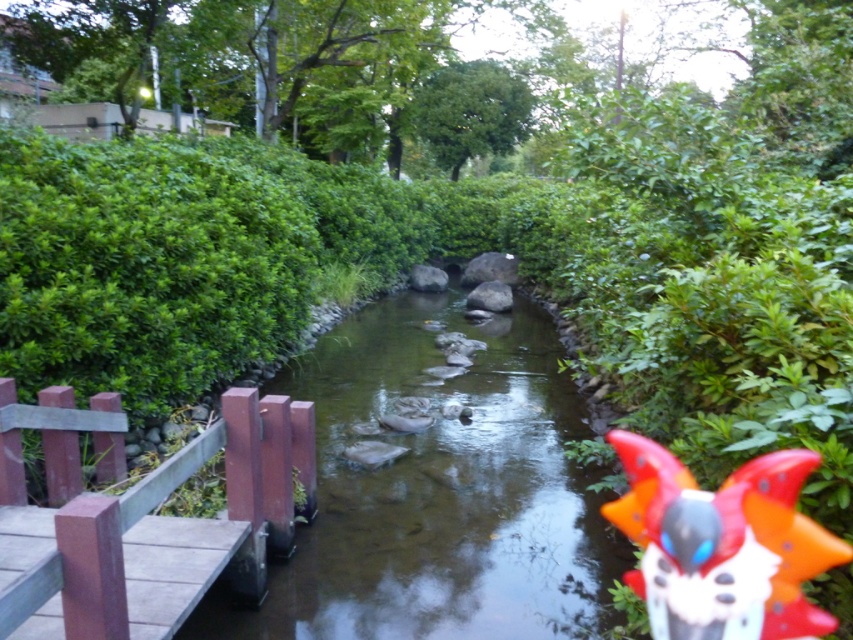
Question: Does wooden bridge rail at left appear over green leafy bush at upper center?

Choices:
 (A) no
 (B) yes

Answer: (A)

Question: Observing the image, what is the correct spatial positioning of wooden bridge rail at left in reference to green leafy bush at upper center?

Choices:
 (A) right
 (B) left

Answer: (B)

Question: Which point is farther from the camera taking this photo?

Choices:
 (A) (129, 556)
 (B) (462, 614)
 (C) (782, 470)
 (D) (502, 92)

Answer: (D)

Question: Is smooth brown stream at center thinner than shiny plastic toy at right?

Choices:
 (A) no
 (B) yes

Answer: (A)

Question: Which point is farther to the camera?

Choices:
 (A) smooth brown stream at center
 (B) shiny plastic toy at right

Answer: (A)

Question: Which object appears closest to the camera in this image?

Choices:
 (A) wooden bridge rail at left
 (B) shiny plastic toy at right
 (C) smooth brown stream at center
 (D) green leafy bush at upper center

Answer: (A)